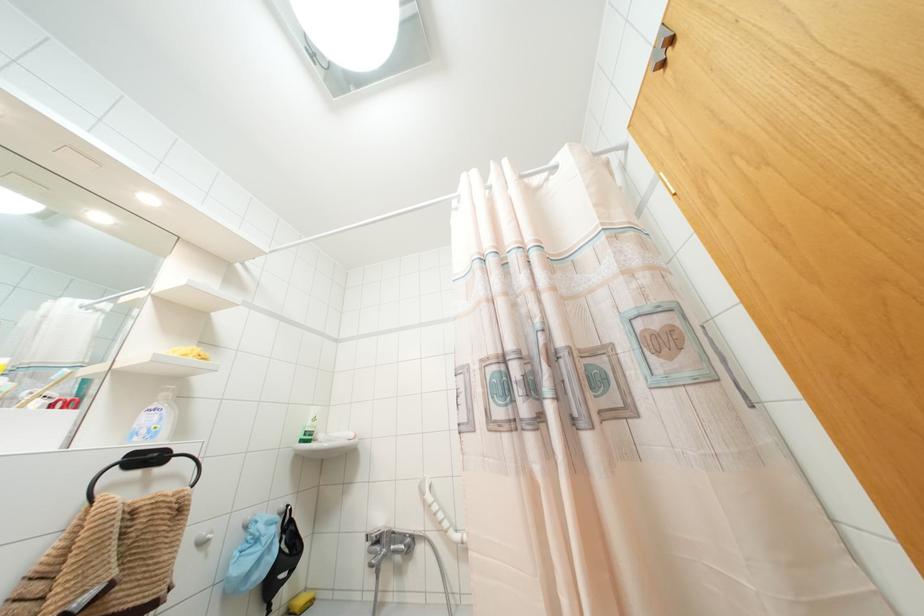
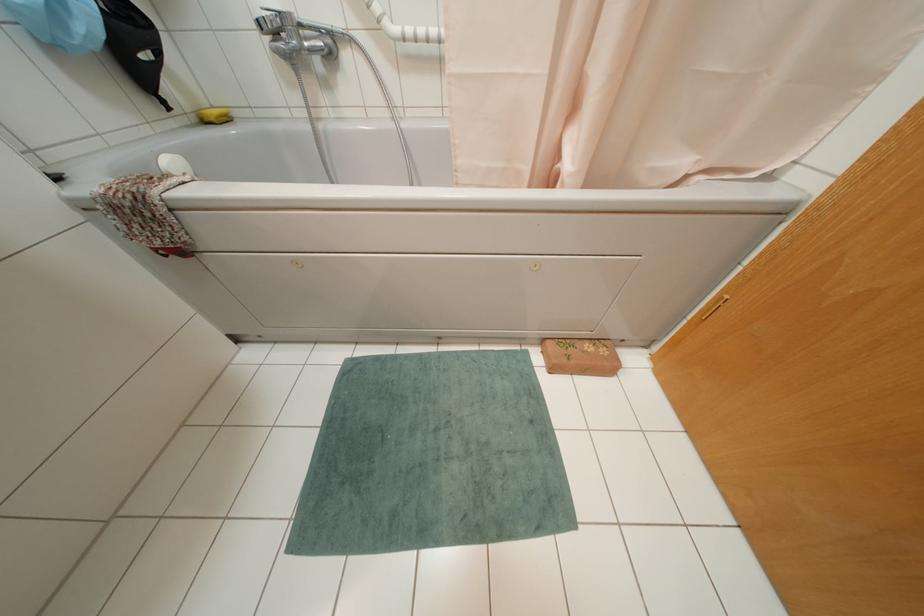
Locate, in the second image, the point that corresponds to point (381, 533) in the first image.

(278, 12)